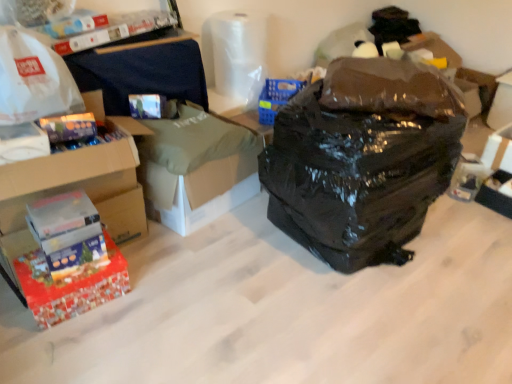
This screenshot has height=384, width=512. In order to click on vacant area located to the right-hand side of red glossy box at lower left, the third box positioned from the top in this screenshot , I will do `click(149, 297)`.